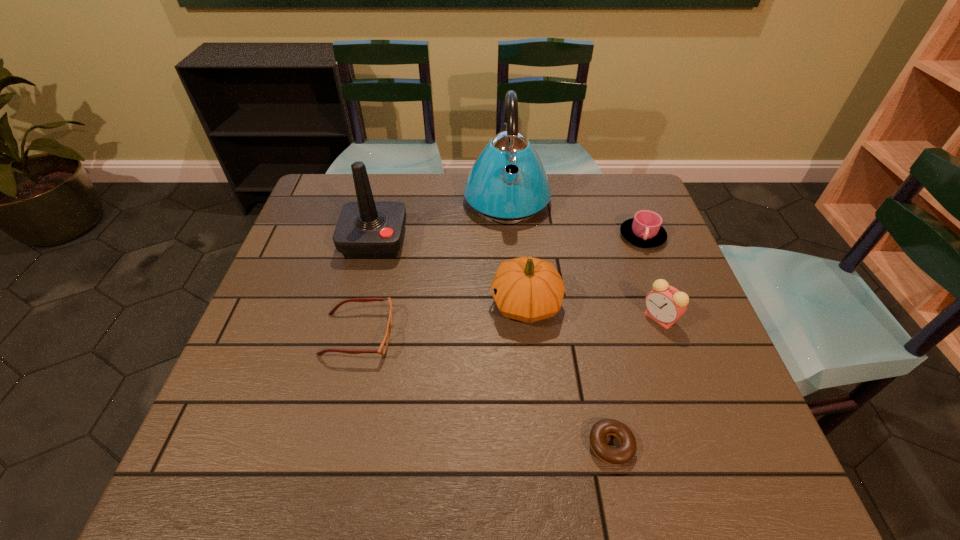
Where is `vacant area that lies between the alarm clock and the spectacles`? vacant area that lies between the alarm clock and the spectacles is located at coordinates (509, 326).

Find the location of `free spot between the shortest object and the fifth shortest object`. free spot between the shortest object and the fifth shortest object is located at coordinates (568, 375).

Where is `blank region between the tallest object and the gourd`? The height and width of the screenshot is (540, 960). blank region between the tallest object and the gourd is located at coordinates (516, 252).

Locate an element on the screen. unoccupied position between the fifth tallest object and the third tallest object is located at coordinates (584, 270).

I want to click on vacant space in between the fourth shortest object and the doughnut, so click(x=635, y=382).

I want to click on vacant area that lies between the joystick and the third tallest object, so click(x=450, y=272).

At what (x,y) coordinates should I click in order to perform the action: click on free area in between the shortest object and the second shortest object. Please return your answer as a coordinate pair (x, y). The width and height of the screenshot is (960, 540). Looking at the image, I should click on (484, 390).

Where is `free space that is in between the doughnut and the third tallest object`? The width and height of the screenshot is (960, 540). free space that is in between the doughnut and the third tallest object is located at coordinates (568, 375).

Identify which object is located as the fifth nearest to the nearest object. Please provide its 2D coordinates. Your answer should be formatted as a tuple, i.e. [(x, y)], where the tuple contains the x and y coordinates of a point satisfying the conditions above.

[(494, 194)]

Choose which object is the third nearest neighbor to the third tallest object. Please provide its 2D coordinates. Your answer should be formatted as a tuple, i.e. [(x, y)], where the tuple contains the x and y coordinates of a point satisfying the conditions above.

[(644, 230)]